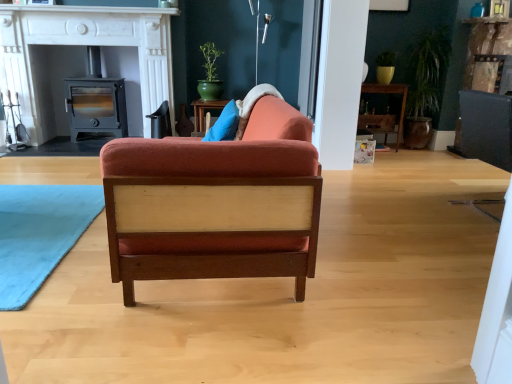
Question: Is velvet orange chair at center bigger or smaller than wooden shelf at center?

Choices:
 (A) big
 (B) small

Answer: (A)

Question: In the image, is velvet orange chair at center positioned in front of or behind wooden shelf at center?

Choices:
 (A) front
 (B) behind

Answer: (A)

Question: Which object is the closest to the green glazed pot at upper center?

Choices:
 (A) velvet orange chair at center
 (B) wooden shelf at center
 (C) matte black wood stove at left
 (D) matte black wood-burning stove at left

Answer: (C)

Question: Which object is the closest to the green glazed pot at upper center?

Choices:
 (A) velvet orange chair at center
 (B) wooden shelf at center
 (C) matte black wood-burning stove at left
 (D) matte black wood stove at left

Answer: (D)